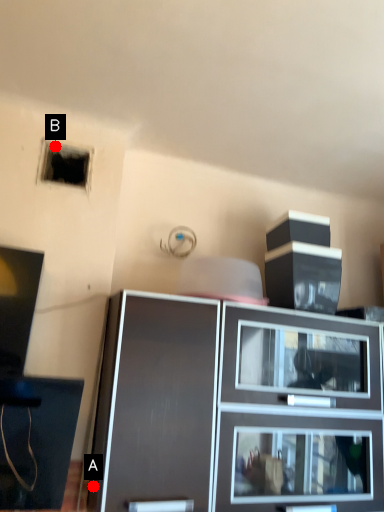
Question: Two points are circled on the image, labeled by A and B beside each circle. Which point appears closest to the camera in this image?

Choices:
 (A) A is closer
 (B) B is closer

Answer: (A)